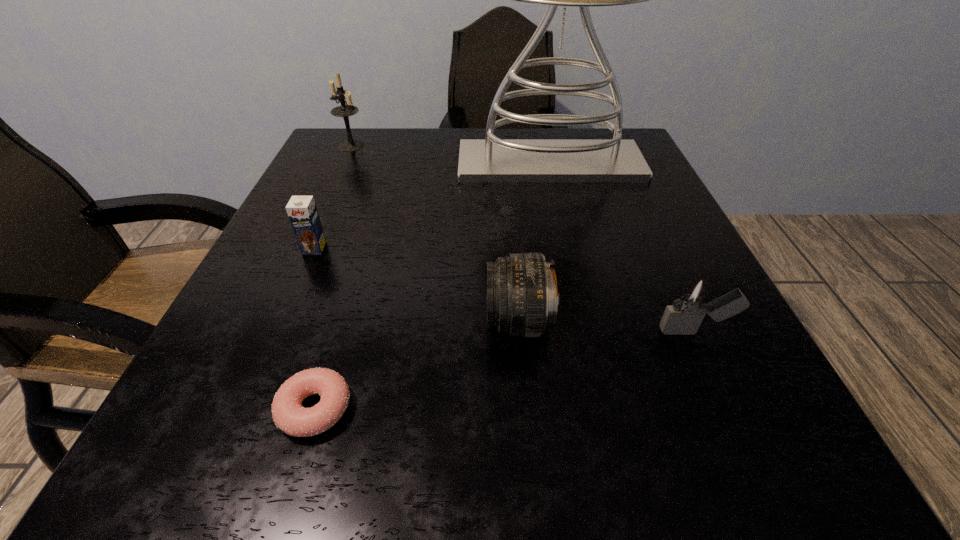
The image size is (960, 540). Find the location of `vacant point located between the telephoto lens and the candle holder`. vacant point located between the telephoto lens and the candle holder is located at coordinates (435, 234).

The height and width of the screenshot is (540, 960). In order to click on empty space that is in between the doughnut and the candle holder in this screenshot , I will do `click(333, 277)`.

Point out which object is positioned as the fifth nearest to the third farthest object. Please provide its 2D coordinates. Your answer should be formatted as a tuple, i.e. [(x, y)], where the tuple contains the x and y coordinates of a point satisfying the conditions above.

[(690, 303)]

Where is `object that is the fourth closest to the tallest object`? Image resolution: width=960 pixels, height=540 pixels. object that is the fourth closest to the tallest object is located at coordinates (690, 303).

Locate an element on the screen. This screenshot has width=960, height=540. free location that satisfies the following two spatial constraints: 1. on the back side of the table lamp; 2. on the left side of the nearest object is located at coordinates (x=389, y=164).

Where is `vacant space that satisfies the following two spatial constraints: 1. at the front element of the telephoto lens; 2. on the front side of the third object from left to right`? The height and width of the screenshot is (540, 960). vacant space that satisfies the following two spatial constraints: 1. at the front element of the telephoto lens; 2. on the front side of the third object from left to right is located at coordinates (525, 408).

Find the location of a particular element. Image resolution: width=960 pixels, height=540 pixels. vacant space that satisfies the following two spatial constraints: 1. at the front element of the igniter; 2. on the left side of the telephoto lens is located at coordinates (518, 331).

Where is `free location that satisfies the following two spatial constraints: 1. at the front element of the telephoto lens; 2. on the back side of the igniter`? free location that satisfies the following two spatial constraints: 1. at the front element of the telephoto lens; 2. on the back side of the igniter is located at coordinates (518, 331).